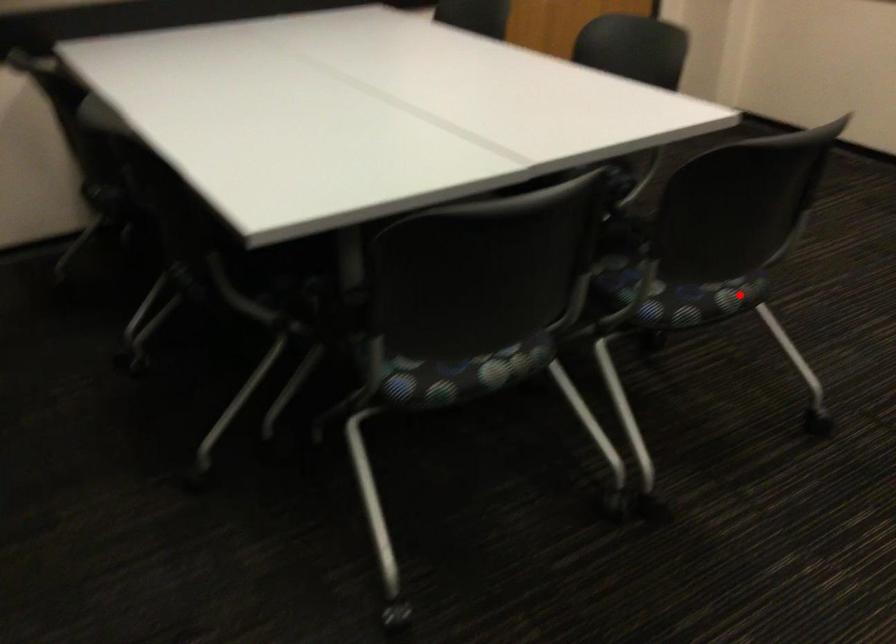
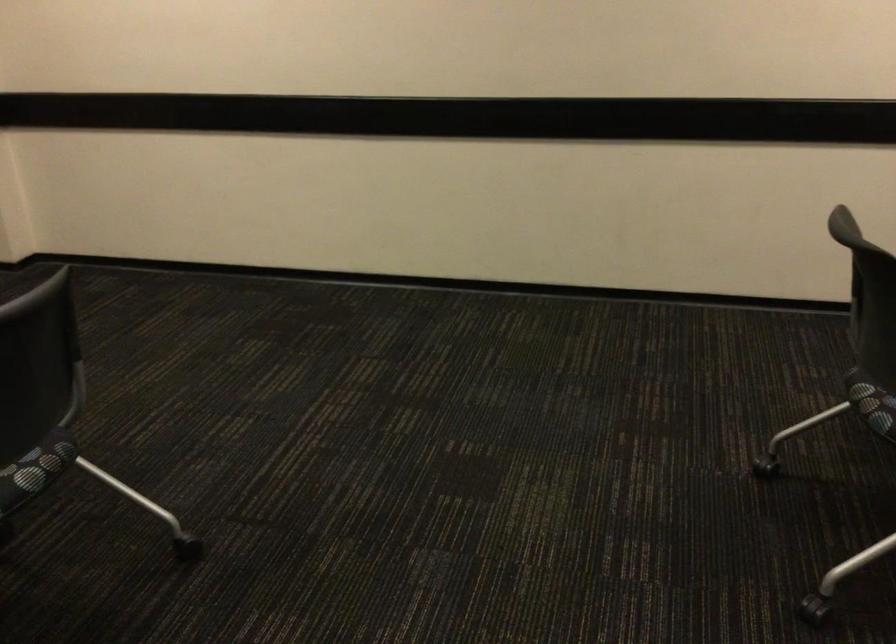
Where in the second image is the point corresponding to the highlighted location from the first image?

(40, 462)